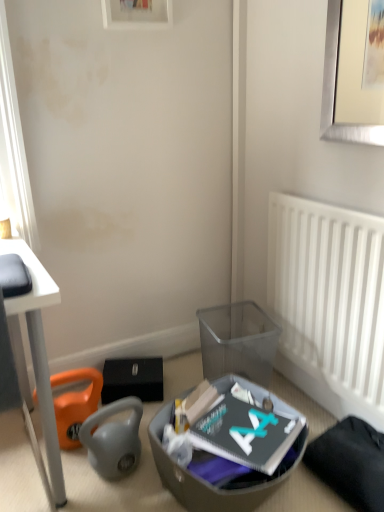
Question: Does wooden picture frame at upper center have a greater width compared to translucent plastic shoe box at lower center?

Choices:
 (A) no
 (B) yes

Answer: (A)

Question: Can you confirm if wooden picture frame at upper center is positioned to the left of translucent plastic shoe box at lower center?

Choices:
 (A) no
 (B) yes

Answer: (B)

Question: From the image's perspective, would you say wooden picture frame at upper center is positioned over translucent plastic shoe box at lower center?

Choices:
 (A) no
 (B) yes

Answer: (B)

Question: Does wooden picture frame at upper center have a lesser height compared to translucent plastic shoe box at lower center?

Choices:
 (A) no
 (B) yes

Answer: (B)

Question: From the image's perspective, is wooden picture frame at upper center beneath translucent plastic shoe box at lower center?

Choices:
 (A) no
 (B) yes

Answer: (A)

Question: Is translucent plastic shoe box at lower center surrounded by wooden picture frame at upper center?

Choices:
 (A) no
 (B) yes

Answer: (A)

Question: From the image's perspective, is white plastic radiator at right above wooden picture frame at upper center?

Choices:
 (A) yes
 (B) no

Answer: (B)

Question: Can you confirm if white plastic radiator at right is shorter than wooden picture frame at upper center?

Choices:
 (A) yes
 (B) no

Answer: (B)

Question: Is white plastic radiator at right directly adjacent to wooden picture frame at upper center?

Choices:
 (A) yes
 (B) no

Answer: (B)

Question: Does white plastic radiator at right have a greater height compared to wooden picture frame at upper center?

Choices:
 (A) yes
 (B) no

Answer: (A)

Question: Can you confirm if white plastic radiator at right is smaller than wooden picture frame at upper center?

Choices:
 (A) no
 (B) yes

Answer: (A)

Question: Is white plastic radiator at right positioned in front of wooden picture frame at upper center?

Choices:
 (A) no
 (B) yes

Answer: (B)

Question: Is translucent plastic shoe box at lower center shorter than orange fabric bean bag chair at lower left?

Choices:
 (A) yes
 (B) no

Answer: (B)